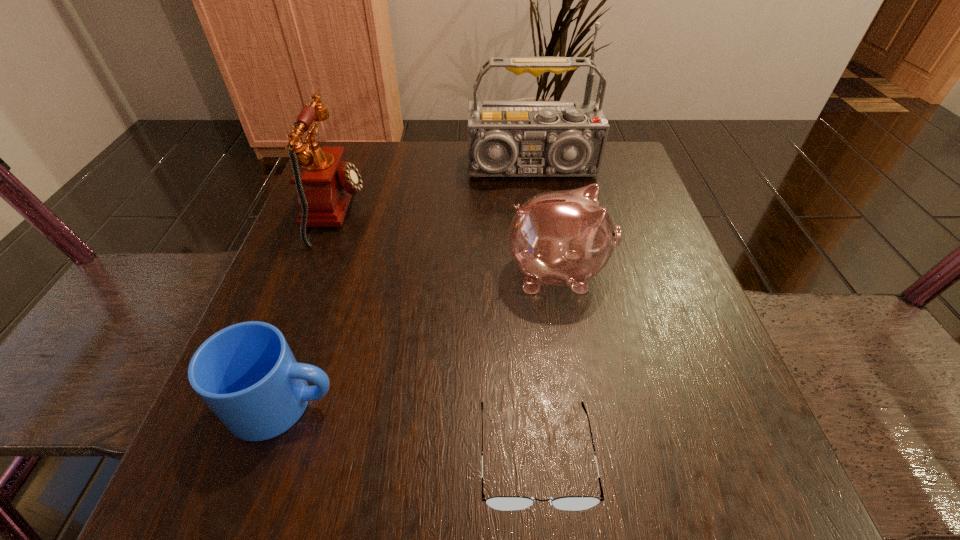
Identify the location of telephone that is at the far edge. The image size is (960, 540). (325, 183).

Where is `object located in the near edge section of the desktop`? The width and height of the screenshot is (960, 540). object located in the near edge section of the desktop is located at coordinates (504, 503).

What are the coordinates of `telephone present at the left edge` in the screenshot? It's located at (325, 183).

Find the location of `mug situated at the left edge`. mug situated at the left edge is located at coordinates (246, 373).

Image resolution: width=960 pixels, height=540 pixels. What are the coordinates of `radio receiver at the right edge` in the screenshot? It's located at (505, 138).

Where is `piggy bank present at the right edge`? piggy bank present at the right edge is located at coordinates (563, 238).

Find the location of a particular element. Image resolution: width=960 pixels, height=540 pixels. object that is at the far left corner is located at coordinates (325, 183).

Locate an element on the screen. This screenshot has width=960, height=540. object that is at the far right corner is located at coordinates pyautogui.click(x=505, y=138).

The height and width of the screenshot is (540, 960). In the image, there is a desktop. What are the coordinates of `vacant space at the far edge` in the screenshot? It's located at (454, 198).

The height and width of the screenshot is (540, 960). What are the coordinates of `vacant space at the near edge of the desktop` in the screenshot? It's located at (644, 519).